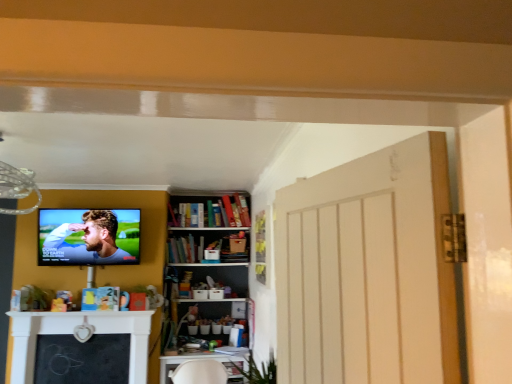
Question: From the image's perspective, is white plastic table at lower center below hardcover books at center?

Choices:
 (A) no
 (B) yes

Answer: (B)

Question: Is white plastic table at lower center bigger than hardcover books at center?

Choices:
 (A) no
 (B) yes

Answer: (B)

Question: Is white plastic table at lower center with hardcover books at center?

Choices:
 (A) yes
 (B) no

Answer: (B)

Question: Does white plastic table at lower center have a smaller size compared to hardcover books at center?

Choices:
 (A) yes
 (B) no

Answer: (B)

Question: Is white plastic table at lower center further to the viewer compared to hardcover books at center?

Choices:
 (A) no
 (B) yes

Answer: (A)

Question: Is white plastic table at lower center taller than hardcover books at center?

Choices:
 (A) yes
 (B) no

Answer: (A)

Question: Considering the relative sizes of white plastic table at lower center and matte black tv at upper left in the image provided, is white plastic table at lower center thinner than matte black tv at upper left?

Choices:
 (A) no
 (B) yes

Answer: (A)

Question: Is white plastic table at lower center positioned before matte black tv at upper left?

Choices:
 (A) no
 (B) yes

Answer: (A)

Question: From the image's perspective, is white plastic table at lower center located above matte black tv at upper left?

Choices:
 (A) yes
 (B) no

Answer: (B)

Question: Can you confirm if white plastic table at lower center is positioned to the right of matte black tv at upper left?

Choices:
 (A) no
 (B) yes

Answer: (B)

Question: From the image's perspective, is white plastic table at lower center beneath matte black tv at upper left?

Choices:
 (A) yes
 (B) no

Answer: (A)

Question: Would you say matte black tv at upper left is part of white plastic table at lower center's contents?

Choices:
 (A) no
 (B) yes

Answer: (A)

Question: From a real-world perspective, is hardcover books at center positioned under matte black tv at upper left based on gravity?

Choices:
 (A) yes
 (B) no

Answer: (A)